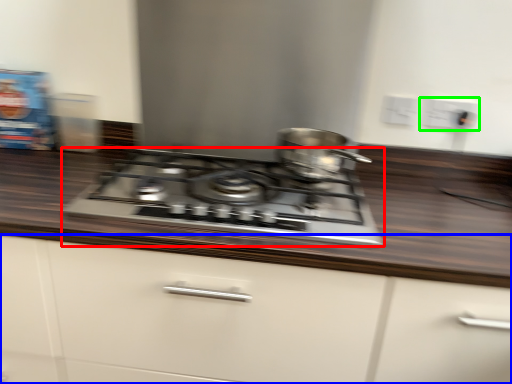
Question: Which object is positioned closest to gas stove (highlighted by a red box)? Select from cabinetry (highlighted by a blue box) and electric outlet (highlighted by a green box).

Choices:
 (A) cabinetry
 (B) electric outlet

Answer: (A)